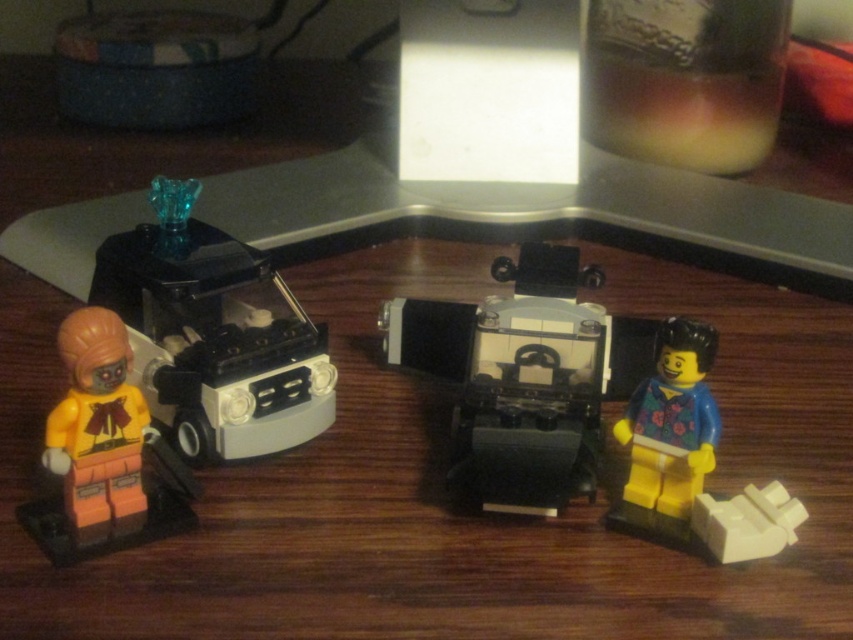
Question: Can you confirm if matte black car at left is smaller than orange matte minifigure at lower left?

Choices:
 (A) yes
 (B) no

Answer: (B)

Question: Does orange matte minifigure at lower left appear on the right side of floral-patterned plastic minifigure at lower right?

Choices:
 (A) no
 (B) yes

Answer: (A)

Question: Among these points, which one is farthest from the camera?

Choices:
 (A) (61, 406)
 (B) (648, 454)
 (C) (595, 332)

Answer: (C)

Question: Among these objects, which one is farthest from the camera?

Choices:
 (A) black plastic car at center
 (B) matte black car at left
 (C) blue fabric minifigure at right
 (D) orange matte minifigure at lower left

Answer: (B)

Question: Which point is closer to the camera taking this photo?

Choices:
 (A) click(485, 499)
 (B) click(669, 358)

Answer: (B)

Question: In this image, where is orange matte minifigure at lower left located relative to blue fabric minifigure at right?

Choices:
 (A) below
 (B) above

Answer: (B)